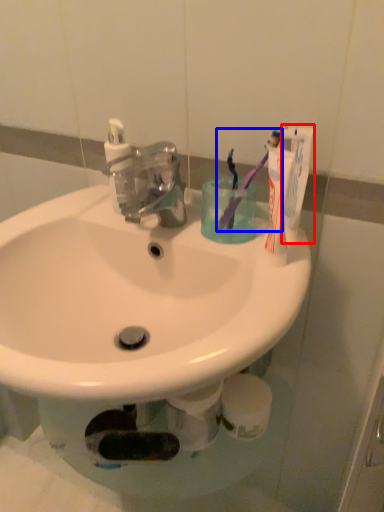
Question: Which object is further to the camera taking this photo, toothpaste (highlighted by a red box) or toothbrush (highlighted by a blue box)?

Choices:
 (A) toothpaste
 (B) toothbrush

Answer: (B)